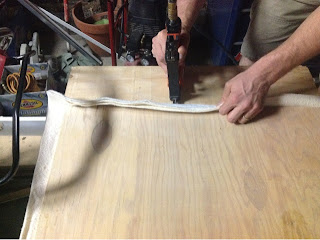
I want to click on tan wood, so click(x=131, y=86), click(x=152, y=161).